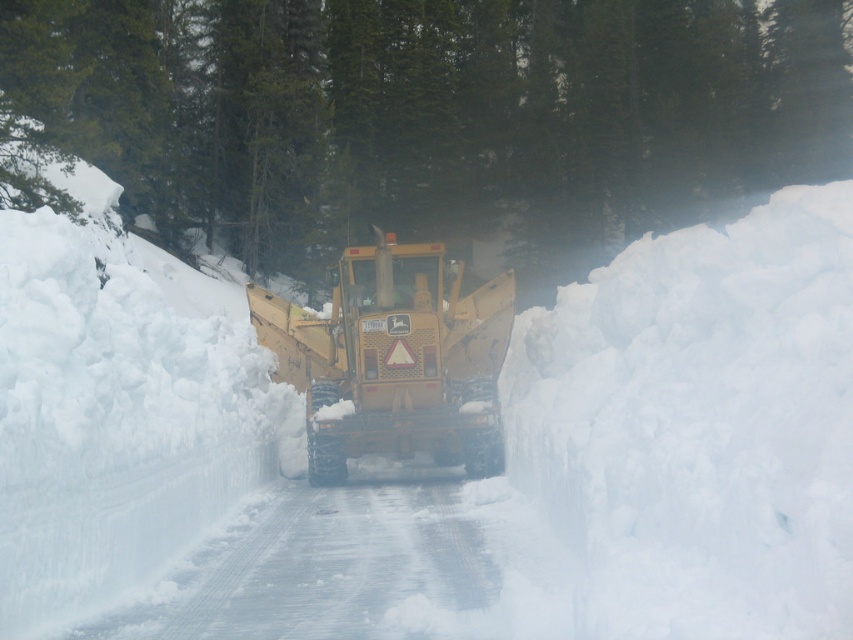
Which is more to the left, green matte tree at upper center or metallic yellow snowplow at center?

metallic yellow snowplow at center

Which is above, green matte tree at upper center or metallic yellow snowplow at center?

green matte tree at upper center is higher up.

Identify the location of green matte tree at upper center. This screenshot has height=640, width=853. (434, 109).